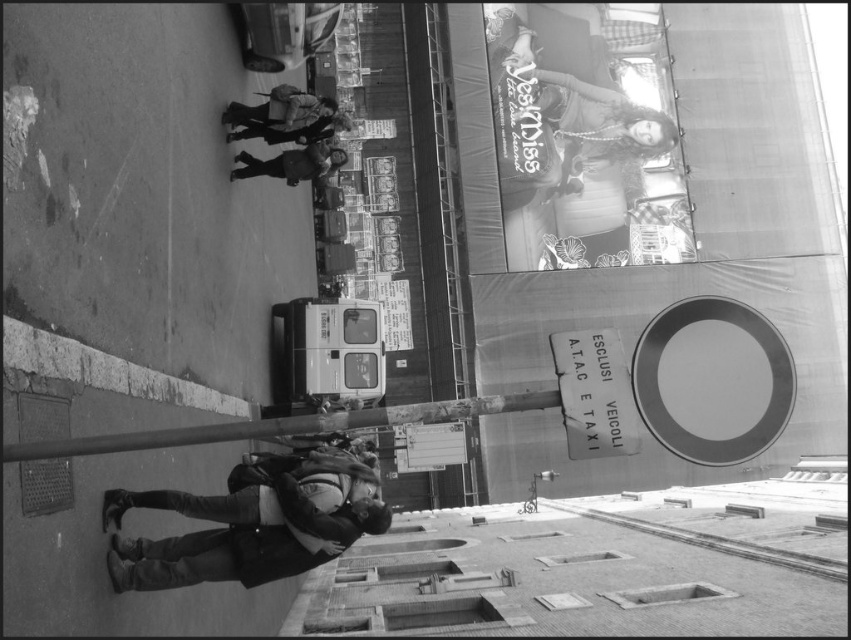
Question: Can you confirm if smooth metal pole at center is thinner than dark gray jacket at center?

Choices:
 (A) no
 (B) yes

Answer: (A)

Question: Can you confirm if smooth metal pole at center is wider than dark gray jacket at center?

Choices:
 (A) no
 (B) yes

Answer: (B)

Question: Which object is closer to the camera taking this photo?

Choices:
 (A) smooth metal pole at center
 (B) dark gray jacket at center

Answer: (A)

Question: From the image, what is the correct spatial relationship of smooth metal pole at center in relation to dark gray jacket at center?

Choices:
 (A) right
 (B) left

Answer: (A)

Question: Which of the following is the farthest from the observer?

Choices:
 (A) smooth metal pole at center
 (B) dark gray jacket at center

Answer: (B)